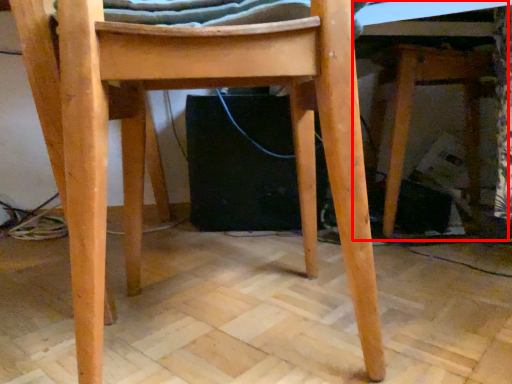
Question: From the image's perspective, where is table (annotated by the red box) located relative to chair?

Choices:
 (A) below
 (B) above

Answer: (B)